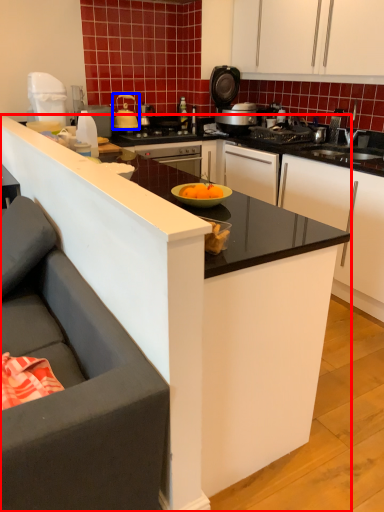
Question: Which of the following is the farthest to the observer, countertop (highlighted by a red box) or kitchen appliance (highlighted by a blue box)?

Choices:
 (A) countertop
 (B) kitchen appliance

Answer: (B)